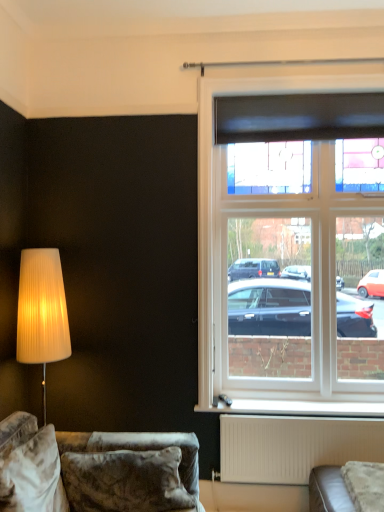
The height and width of the screenshot is (512, 384). In order to click on empty space that is ontop of white matte radiator at lower center (from a real-world perspective) in this screenshot , I will do `click(315, 413)`.